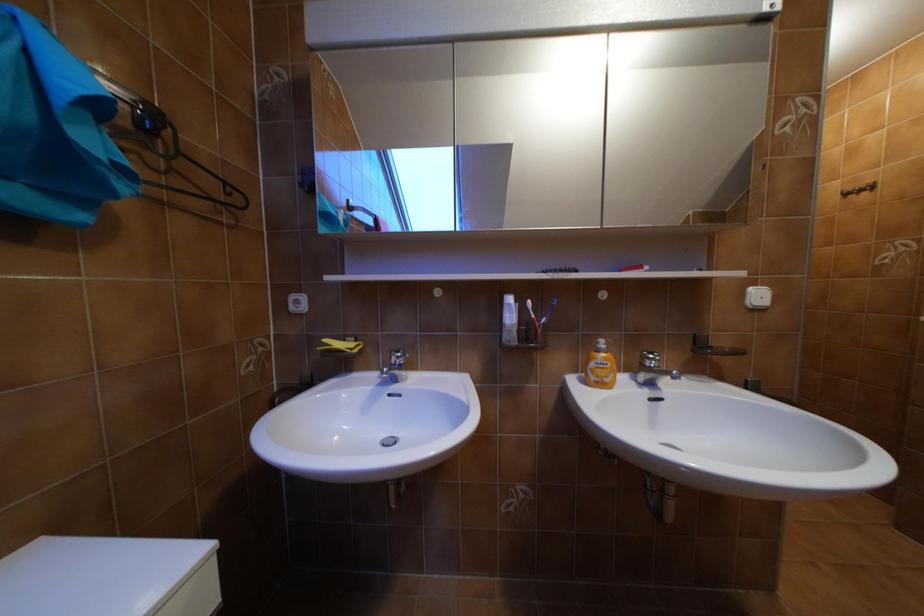
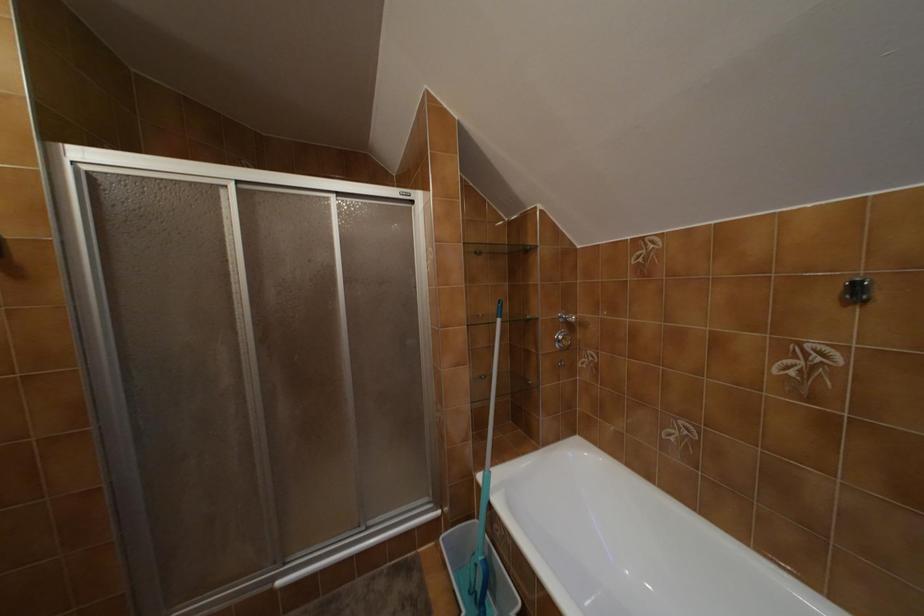
Question: The camera is either moving clockwise (left) or counter-clockwise (right) around the object. The first image is from the beginning of the video and the second image is from the end. Is the camera moving left or right when shooting the video?

Choices:
 (A) Left
 (B) Right

Answer: (A)